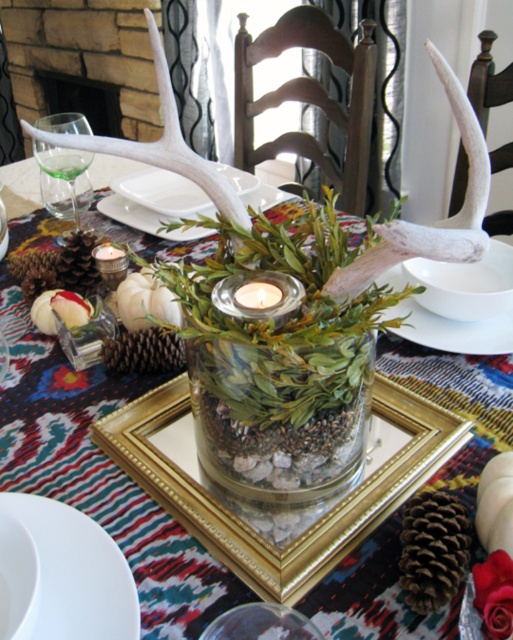
Question: Considering the relative positions of brown rough pine cone at center and transparent glass wine glass at left in the image provided, where is brown rough pine cone at center located with respect to transparent glass wine glass at left?

Choices:
 (A) above
 (B) below

Answer: (B)

Question: Can you confirm if transparent glass wine glass at left is positioned below translucent glass platter at center?

Choices:
 (A) no
 (B) yes

Answer: (A)

Question: Among these objects, which one is farthest from the camera?

Choices:
 (A) white porcelain plate at center
 (B) translucent glass platter at center
 (C) white ceramic plate at lower left

Answer: (A)

Question: Which point is closer to the camera taking this photo?

Choices:
 (A) (70, 557)
 (B) (406, 541)
 (C) (43, 192)

Answer: (A)

Question: Can you confirm if white ceramic plate at lower left is positioned above translucent glass candle at center?

Choices:
 (A) no
 (B) yes

Answer: (A)

Question: Considering the real-world distances, which object is closest to the white porcelain plate at center?

Choices:
 (A) brown rough pine cone at center
 (B) white ceramic plate at lower left
 (C) translucent glass platter at center

Answer: (C)